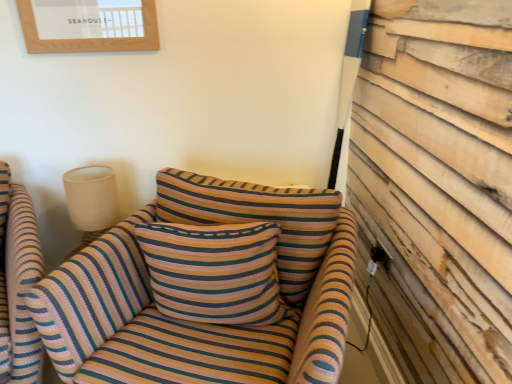
Question: Is point (34, 24) positioned closer to the camera than point (106, 203)?

Choices:
 (A) farther
 (B) closer

Answer: (B)

Question: Considering the relative positions of wooden framed picture at upper left and beige fabric lampshade at upper left in the image provided, is wooden framed picture at upper left to the left or to the right of beige fabric lampshade at upper left?

Choices:
 (A) right
 (B) left

Answer: (A)

Question: Which is nearer to the wooden framed picture at upper left?

Choices:
 (A) striped fabric chair at left
 (B) striped fabric couch at center
 (C) beige fabric lampshade at upper left
 (D) striped fabric pillow at center

Answer: (C)

Question: Which object is the closest to the wooden framed picture at upper left?

Choices:
 (A) striped fabric chair at left
 (B) beige fabric lampshade at upper left
 (C) striped fabric pillow at center
 (D) striped fabric couch at center

Answer: (B)